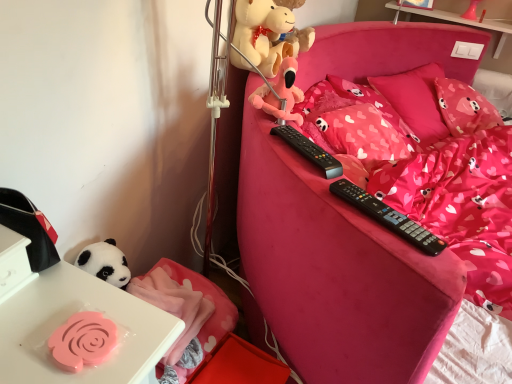
What do you see at coordinates (334, 272) in the screenshot? The width and height of the screenshot is (512, 384). I see `pink fabric bed at center` at bounding box center [334, 272].

You are a GUI agent. You are given a task and a screenshot of the screen. Output one action in this format:
    pyautogui.click(x=<x>, y=<y>)
    Task: Click on the pink fabric pillow at upper right, the second pillow positioned from the left
    The width and height of the screenshot is (512, 384).
    Given the screenshot: What is the action you would take?
    pyautogui.click(x=464, y=108)

At what (x,y) coordinates should I click in order to perform the action: click on pink fabric blanket at lower left. Please return your answer as a coordinate pair (x, y). Looking at the image, I should click on (174, 306).

Does matte pink plush at upper center touch black plastic remote control at center, the 1th remote control in the top-to-bottom sequence?

There is a gap between matte pink plush at upper center and black plastic remote control at center, the 1th remote control in the top-to-bottom sequence.

From a real-world perspective, which object stands above the other?

matte pink plush at upper center is physically above.

From the image's perspective, is matte pink plush at upper center located above black plastic remote control at center, acting as the first remote control starting from the back?

Indeed, from the image's perspective, matte pink plush at upper center is shown above black plastic remote control at center, acting as the first remote control starting from the back.

From a real-world perspective, which is physically above, pink fabric pillow at upper right, which is the 2th pillow from right to left, or matte pink plush at upper center?

matte pink plush at upper center, from a real-world perspective.

Considering the relative sizes of pink fabric pillow at upper right, which is the 2th pillow from right to left, and matte pink plush at upper center in the image provided, is pink fabric pillow at upper right, which is the 2th pillow from right to left, smaller than matte pink plush at upper center?

No.

Is pink fabric pillow at upper right, positioned as the 1th pillow in left-to-right order, with matte pink plush at upper center?

No, pink fabric pillow at upper right, positioned as the 1th pillow in left-to-right order, is not next to matte pink plush at upper center.

Choose the correct answer: Is pink fabric pillow at upper right, positioned as the 1th pillow in left-to-right order, inside matte pink plush at upper center or outside it?

pink fabric pillow at upper right, positioned as the 1th pillow in left-to-right order, is not enclosed by matte pink plush at upper center.

From a real-world perspective, between soft plush teddy bear at upper center and pink fabric bed at center, who is vertically lower?

pink fabric bed at center, from a real-world perspective.

Who is shorter, soft plush teddy bear at upper center or pink fabric bed at center?

Standing shorter between the two is soft plush teddy bear at upper center.

Based on the photo, how far apart are soft plush teddy bear at upper center and pink fabric bed at center?

soft plush teddy bear at upper center and pink fabric bed at center are 16.84 inches apart.

From the image's perspective, relative to pink fabric bed at center, is soft plush teddy bear at upper center above or below?

soft plush teddy bear at upper center is above pink fabric bed at center.

How much distance is there between pink fabric pillow at upper right, the second pillow positioned from the left, and matte pink plush at upper center?

pink fabric pillow at upper right, the second pillow positioned from the left, is 1.42 meters from matte pink plush at upper center.

You are a GUI agent. You are given a task and a screenshot of the screen. Output one action in this format:
    pyautogui.click(x=<x>, y=<y>)
    Task: Click on the 2nd pillow behind when counting from the matte pink plush at upper center
    
    Given the screenshot: What is the action you would take?
    pyautogui.click(x=464, y=108)

Considering the relative sizes of pink fabric pillow at upper right, the 1th pillow viewed from the right, and matte pink plush at upper center in the image provided, is pink fabric pillow at upper right, the 1th pillow viewed from the right, taller than matte pink plush at upper center?

Yes.

Which is more to the right, pink fabric pillow at upper right, the second pillow positioned from the left, or matte pink plush at upper center?

Positioned to the right is pink fabric pillow at upper right, the second pillow positioned from the left.

Would you say white glossy table at upper right is inside or outside pink fabric blanket at lower left?

white glossy table at upper right lies outside pink fabric blanket at lower left.

Are white glossy table at upper right and pink fabric blanket at lower left located far from each other?

Indeed, white glossy table at upper right is not near pink fabric blanket at lower left.

Where is `blanket below the white glossy table at upper right (from a real-world perspective)`? This screenshot has height=384, width=512. blanket below the white glossy table at upper right (from a real-world perspective) is located at coordinates (174, 306).

Can you confirm if white glossy table at upper right is positioned to the left of pink fabric blanket at lower left?

No, white glossy table at upper right is not to the left of pink fabric blanket at lower left.

Considering the sizes of objects pink fabric pillow at upper right, the 1th pillow viewed from the right, and black plastic remote control at upper right, the 2th remote control positioned from the top, in the image provided, who is wider, pink fabric pillow at upper right, the 1th pillow viewed from the right, or black plastic remote control at upper right, the 2th remote control positioned from the top,?

Wider between the two is pink fabric pillow at upper right, the 1th pillow viewed from the right.

Does point (476, 102) lie in front of point (400, 217)?

No, it is not.

Is black plastic remote control at upper right, acting as the 1th remote control starting from the front, completely or partially inside pink fabric pillow at upper right, the second pillow positioned from the left?

That's incorrect, black plastic remote control at upper right, acting as the 1th remote control starting from the front, is not inside pink fabric pillow at upper right, the second pillow positioned from the left.

From a real-world perspective, is pink fabric bed at center over soft plush teddy bear at upper center?

Actually, pink fabric bed at center is physically below soft plush teddy bear at upper center in the real world.

This screenshot has height=384, width=512. In order to click on furniture on the right of soft plush teddy bear at upper center in this screenshot , I will do `click(334, 272)`.

Does point (310, 233) appear closer or farther from the camera than point (231, 56)?

Point (310, 233) appears to be closer to the viewer than point (231, 56).

Locate an element on the screen. This screenshot has width=512, height=384. the 1st remote control below the matte pink plush at upper center (from a real-world perspective) is located at coordinates (309, 150).

Find the location of a particular element. This screenshot has height=384, width=512. toy in front of the pink fabric pillow at upper right, which is the 2th pillow from right to left is located at coordinates (280, 94).

Considering their positions, is matte pink plush at upper center positioned further to pink fabric bedding at center than pink fabric pillow at upper right, the second pillow positioned from the left?

Among the two, matte pink plush at upper center is located further to pink fabric bedding at center.

When comparing their distances from pink fabric bed at center, does soft plush teddy bear at upper center or matte pink plush at upper center seem closer?

matte pink plush at upper center.

Looking at the image, which one is located further to pink fabric bed at center, pink fabric blanket at lower left or pink fabric pillow at upper right, the second pillow positioned from the left?

pink fabric pillow at upper right, the second pillow positioned from the left, is positioned further to the anchor pink fabric bed at center.

When comparing their distances from pink fabric bed at center, does white glossy table at upper right or black plastic remote control at upper right, the second remote control positioned from the back, seem further?

white glossy table at upper right is further to pink fabric bed at center.

When comparing their distances from white glossy table at upper right, does matte pink plush at upper center or pink fabric bedding at center seem further?

matte pink plush at upper center is further to white glossy table at upper right.

Considering their positions, is black plastic remote control at upper right, acting as the 1th remote control starting from the front, positioned closer to pink fabric blanket at lower left than black plastic remote control at center, placed as the second remote control when sorted from bottom to top?

black plastic remote control at center, placed as the second remote control when sorted from bottom to top.

Looking at the image, which one is located closer to matte pink plush at upper center, pink fabric blanket at lower left or soft plush teddy bear at upper center?

The object closer to matte pink plush at upper center is soft plush teddy bear at upper center.

Which object lies further to the anchor point pink fabric pillow at upper right, the second pillow positioned from the left, black plastic remote control at center, the 1th remote control in the top-to-bottom sequence, or pink fabric bedding at center?

Among the two, black plastic remote control at center, the 1th remote control in the top-to-bottom sequence, is located further to pink fabric pillow at upper right, the second pillow positioned from the left.

This screenshot has width=512, height=384. I want to click on remote control between black plastic remote control at center, placed as the second remote control when sorted from bottom to top, and pink fabric bedding at center from left to right, so click(388, 217).

This screenshot has height=384, width=512. I want to click on teddy bear between matte pink plush at upper center and white glossy table at upper right from front to back, so click(x=270, y=33).

Image resolution: width=512 pixels, height=384 pixels. Find the location of `pillow between black plastic remote control at center, the 1th remote control in the top-to-bottom sequence, and pink fabric pillow at upper right, the 1th pillow viewed from the right, in the front-back direction`. pillow between black plastic remote control at center, the 1th remote control in the top-to-bottom sequence, and pink fabric pillow at upper right, the 1th pillow viewed from the right, in the front-back direction is located at coordinates (415, 101).

You are a GUI agent. You are given a task and a screenshot of the screen. Output one action in this format:
    pyautogui.click(x=<x>, y=<y>)
    Task: Click on the bedding between black plastic remote control at upper right, the second remote control positioned from the back, and white glossy table at upper right from front to back
    The height and width of the screenshot is (384, 512).
    Given the screenshot: What is the action you would take?
    pyautogui.click(x=461, y=206)